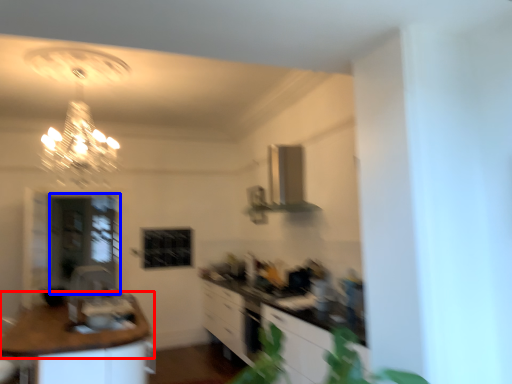
Question: Among these objects, which one is nearest to the camera, countertop (highlighted by a red box) or glass door (highlighted by a blue box)?

Choices:
 (A) countertop
 (B) glass door

Answer: (A)